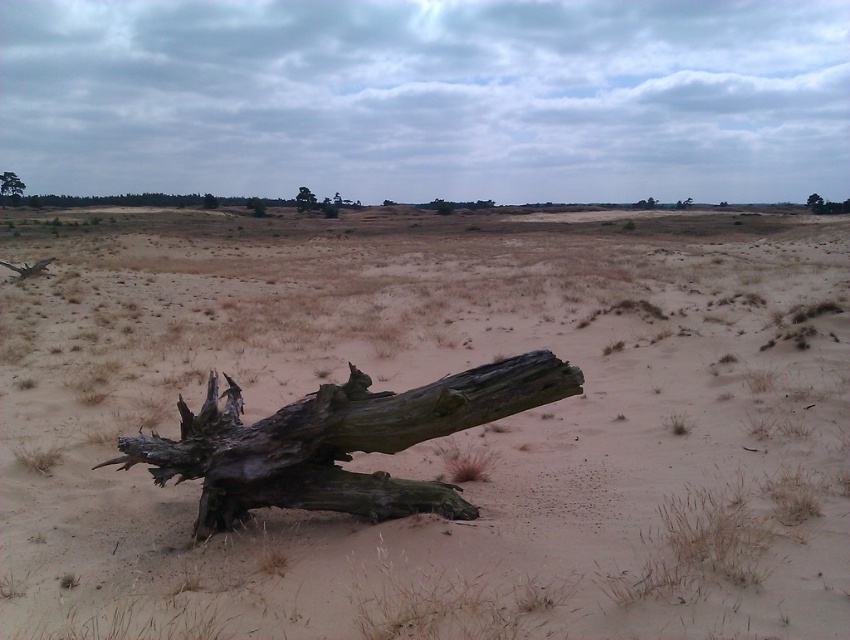
Which is below, dark brown wood at center or green rough bark tree at upper left?

Positioned lower is dark brown wood at center.

Can you confirm if dark brown wood at center is positioned to the left of green rough bark tree at upper left?

Incorrect, dark brown wood at center is not on the left side of green rough bark tree at upper left.

Who is more forward, [434,426] or [24,186]?

Point [434,426]

Locate an element on the screen. This screenshot has width=850, height=640. dark brown wood at center is located at coordinates (338, 442).

In the scene shown: Is the position of brown/dry sand at center more distant than that of green rough bark tree at upper left?

No, brown/dry sand at center is closer to the viewer.

The height and width of the screenshot is (640, 850). Find the location of `brown/dry sand at center`. brown/dry sand at center is located at coordinates (442, 436).

Where is `brown/dry sand at center`? The width and height of the screenshot is (850, 640). brown/dry sand at center is located at coordinates (442, 436).

Which of these two, dark brown wood at center or dark brown wood at upper center, stands shorter?

dark brown wood at center is shorter.

Who is more forward, (341, 413) or (306, 209)?

Point (341, 413)

Image resolution: width=850 pixels, height=640 pixels. Find the location of `dark brown wood at center`. dark brown wood at center is located at coordinates (338, 442).